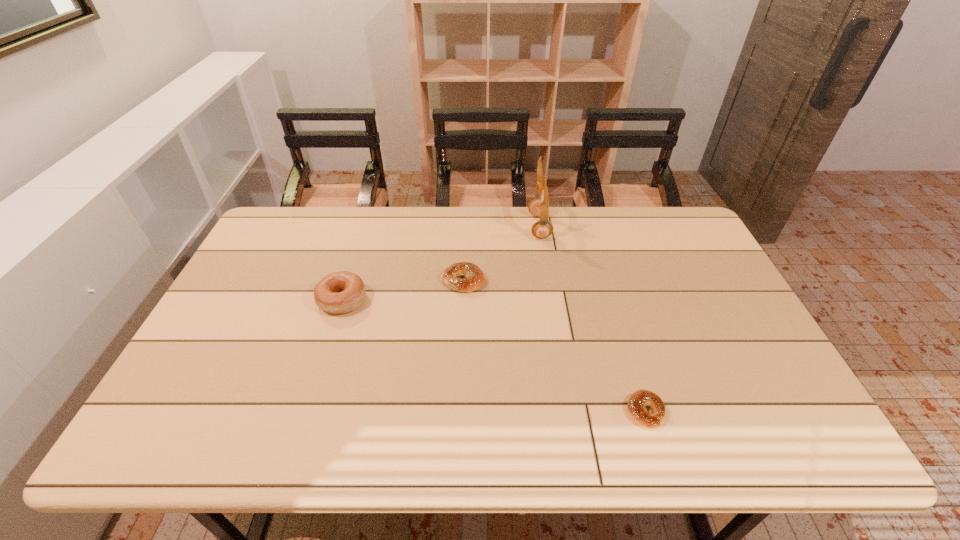
Locate an element on the screen. vacant space at the far right corner of the desktop is located at coordinates (669, 232).

The width and height of the screenshot is (960, 540). In the image, there is a desktop. In order to click on vacant space at the near right corner in this screenshot , I will do `click(808, 419)`.

What are the coordinates of `vacant space in between the rightmost object and the tallest bagel` in the screenshot? It's located at (494, 356).

The width and height of the screenshot is (960, 540). Find the location of `free space that is in between the earphone and the third object from right to left`. free space that is in between the earphone and the third object from right to left is located at coordinates (501, 254).

Where is `vacant area that lies between the leftmost object and the tallest object`? vacant area that lies between the leftmost object and the tallest object is located at coordinates (441, 264).

Image resolution: width=960 pixels, height=540 pixels. In order to click on free space between the third tallest object and the leftmost object in this screenshot , I will do `click(402, 291)`.

Where is `free spot between the second shortest bagel and the earphone`? This screenshot has width=960, height=540. free spot between the second shortest bagel and the earphone is located at coordinates (501, 254).

This screenshot has width=960, height=540. In order to click on vacant region between the leftmost bagel and the nearest object in this screenshot , I will do `click(494, 356)`.

Locate an element on the screen. blank region between the second tallest bagel and the tallest bagel is located at coordinates (402, 291).

Identify the location of vacant area that lies between the earphone and the rightmost bagel. (592, 319).